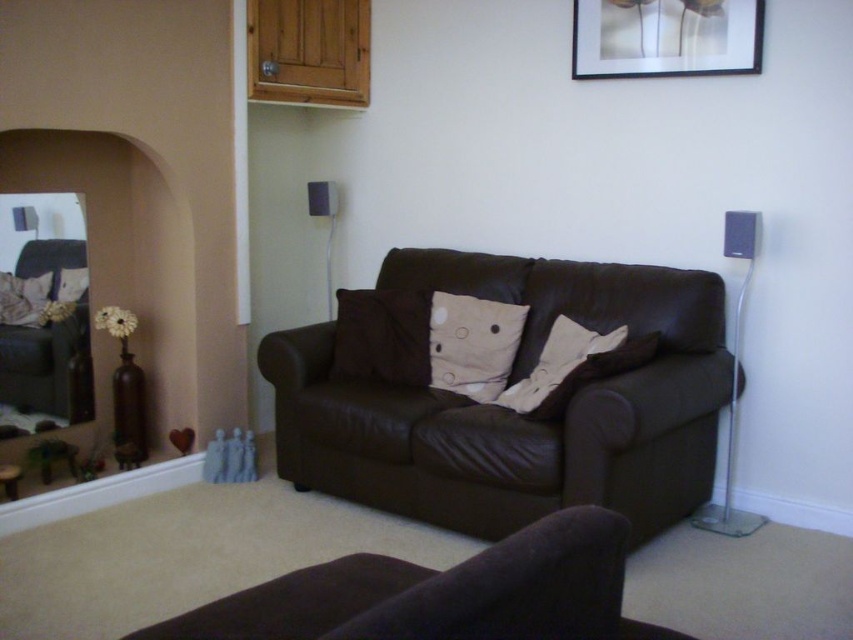
Is point (677, 486) closer to camera compared to point (730, 237)?

Yes, it is.

Consider the image. Is brown leather couch at center in front of black plastic speaker at right?

Yes, brown leather couch at center is in front of black plastic speaker at right.

Is point (585, 410) farther from camera compared to point (730, 243)?

No, (585, 410) is in front of (730, 243).

Where is `brown leather couch at center`? brown leather couch at center is located at coordinates (511, 410).

From the picture: Is suede-like brown armchair at lower center above beige cotton pillow at center?

Actually, suede-like brown armchair at lower center is below beige cotton pillow at center.

Consider the image. Can you confirm if suede-like brown armchair at lower center is positioned to the left of beige cotton pillow at center?

Incorrect, suede-like brown armchair at lower center is not on the left side of beige cotton pillow at center.

This screenshot has height=640, width=853. In order to click on suede-like brown armchair at lower center in this screenshot , I will do `click(437, 593)`.

Looking at this image, does suede-like brown pillow at center have a greater height compared to white cotton pillow at upper left?

Correct, suede-like brown pillow at center is much taller as white cotton pillow at upper left.

Who is positioned more to the left, suede-like brown pillow at center or white cotton pillow at upper left?

white cotton pillow at upper left is more to the left.

Is point (373, 308) closer to viewer compared to point (70, 285)?

Yes, it is.

Image resolution: width=853 pixels, height=640 pixels. In order to click on suede-like brown pillow at center in this screenshot , I will do `click(381, 337)`.